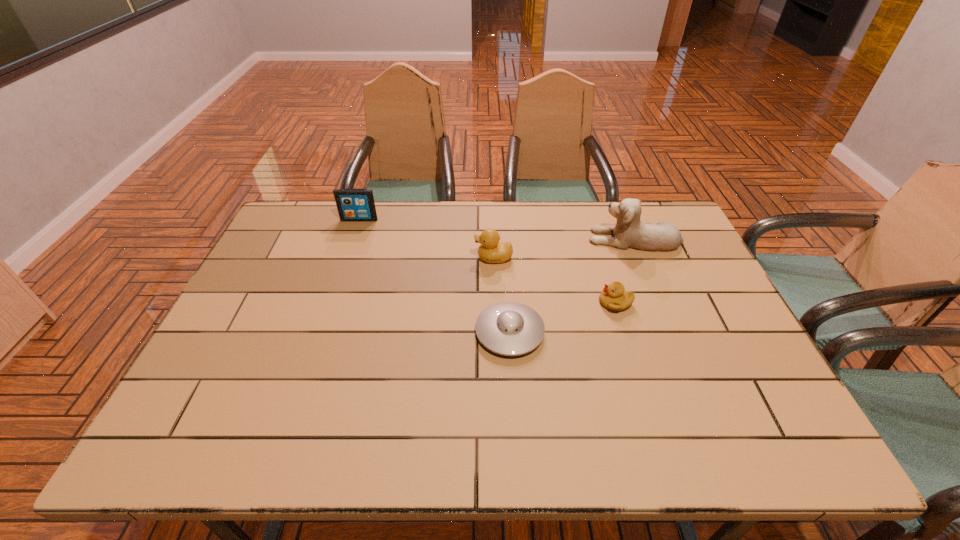
This screenshot has height=540, width=960. Find the location of `vacant space situated 0.190m on the front-facing side of the tallest object`. vacant space situated 0.190m on the front-facing side of the tallest object is located at coordinates (530, 239).

You are a GUI agent. You are given a task and a screenshot of the screen. Output one action in this format:
    pyautogui.click(x=<x>, y=<y>)
    Task: Click on the free space located on the front screen of the farthest object
    The width and height of the screenshot is (960, 540).
    Given the screenshot: What is the action you would take?
    pyautogui.click(x=353, y=238)

At what (x,y) coordinates should I click in order to perform the action: click on vacant space situated 0.130m facing forward on the farther duckling. Please return your answer as a coordinate pair (x, y). The height and width of the screenshot is (540, 960). Looking at the image, I should click on (433, 258).

Where is `vacant region located facing forward on the farther duckling`? The width and height of the screenshot is (960, 540). vacant region located facing forward on the farther duckling is located at coordinates (403, 258).

The width and height of the screenshot is (960, 540). Find the location of `free space located facing forward on the farther duckling`. free space located facing forward on the farther duckling is located at coordinates pyautogui.click(x=381, y=258).

Locate an element on the screen. The image size is (960, 540). vacant position located 0.250m on the front-facing side of the right duckling is located at coordinates (510, 303).

This screenshot has height=540, width=960. Identify the location of vacant space situated 0.210m on the front-facing side of the right duckling. (523, 303).

Identify the location of free space located 0.350m on the front-facing side of the right duckling. click(473, 303).

Identify the location of vacant space located on the left of the saucer. (411, 332).

Locate an element on the screen. This screenshot has width=960, height=540. puppy that is positioned at the far edge is located at coordinates (629, 232).